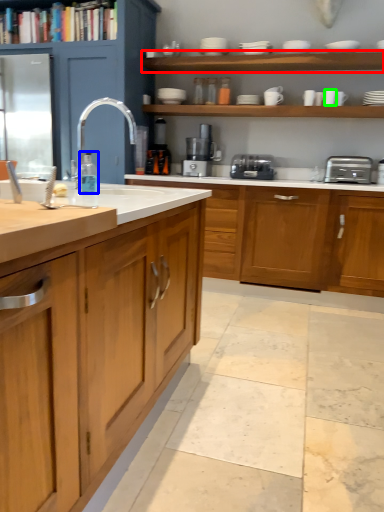
Question: Which is nearer to the shelf (highlighted by a red box)? bottle (highlighted by a blue box) or tableware (highlighted by a green box).

Choices:
 (A) bottle
 (B) tableware

Answer: (B)